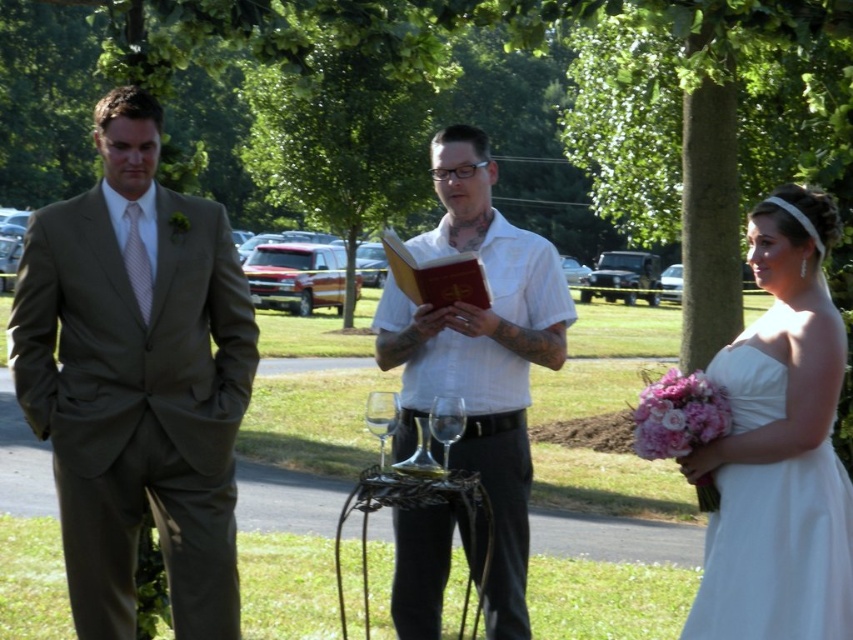
You are a photographer positioned behind the white matte shirt at center and the transparent glass wine glass at center. Which object is closer to your camera lens?

The white matte shirt at center is closer to the camera lens because it is positioned further to the viewer than the transparent glass wine glass at center.

You are a server at a wedding and need to deliver a drink to the transparent glass wine glass at center. The white matte shirt at center is blocking your path. Can you walk around them without getting too close?

The distance between white matte shirt at center and transparent glass wine glass at center is 47.50 centimeters. Since this distance is quite narrow, it might be challenging to walk around the white matte shirt at center without getting too close. Consider using a tray to carry the drink and carefully navigate the space.

What object is located at the coordinates point (480, 353)?

The point (480, 353) corresponds to the white matte shirt at center.